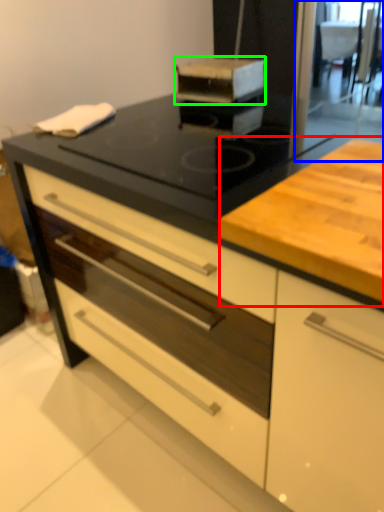
Question: Estimate the real-world distances between objects in this image. Which object is closer to counter (highlighted by a red box), screen door (highlighted by a blue box) or kitchen appliance (highlighted by a green box)?

Choices:
 (A) screen door
 (B) kitchen appliance

Answer: (B)